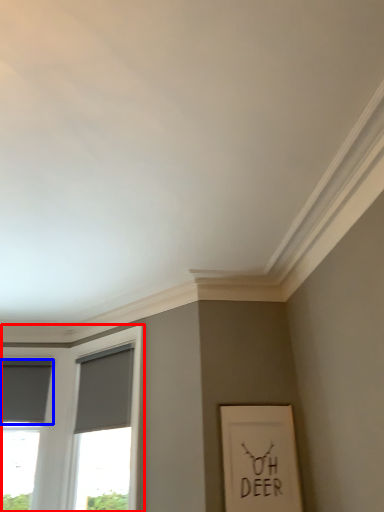
Question: Which object appears closest to the camera in this image, window (highlighted by a red box) or curtain (highlighted by a blue box)?

Choices:
 (A) window
 (B) curtain

Answer: (A)